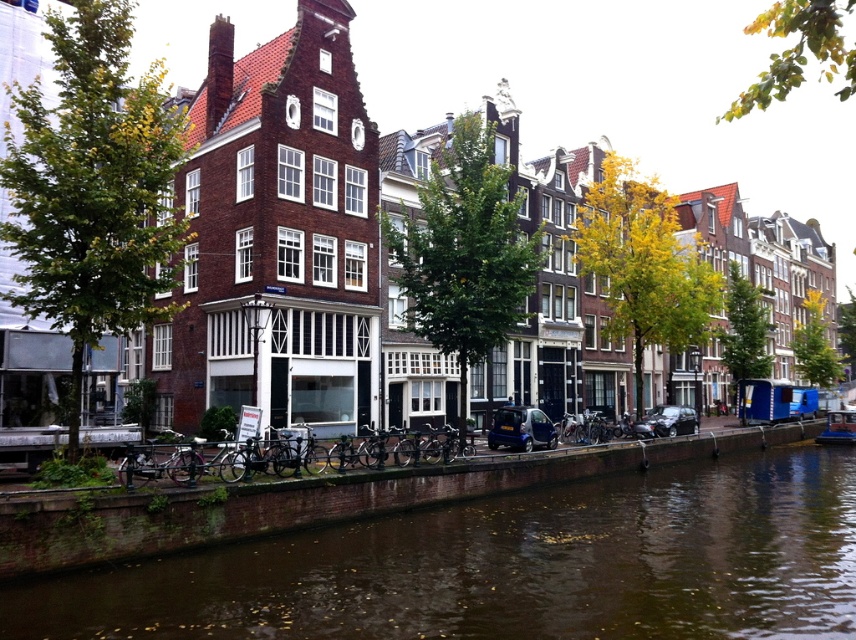
You are a tourist standing on the canal bridge and want to take a photo of the brown water at lower center and the blue plastic boat at right. Which object will occupy more space in your photo?

The brown water at lower center will occupy more space in the photo because its width is larger than the blue plastic boat at right.

You are a tourist standing on the canal bank and want to take a photo of the brown water at lower center and the blue plastic boat at right. Based on their positions, which object should you focus on first to ensure both are in the frame?

The brown water at lower center is in front of the blue plastic boat at right, so you should focus on the blue plastic boat at right first to ensure both are in the frame.